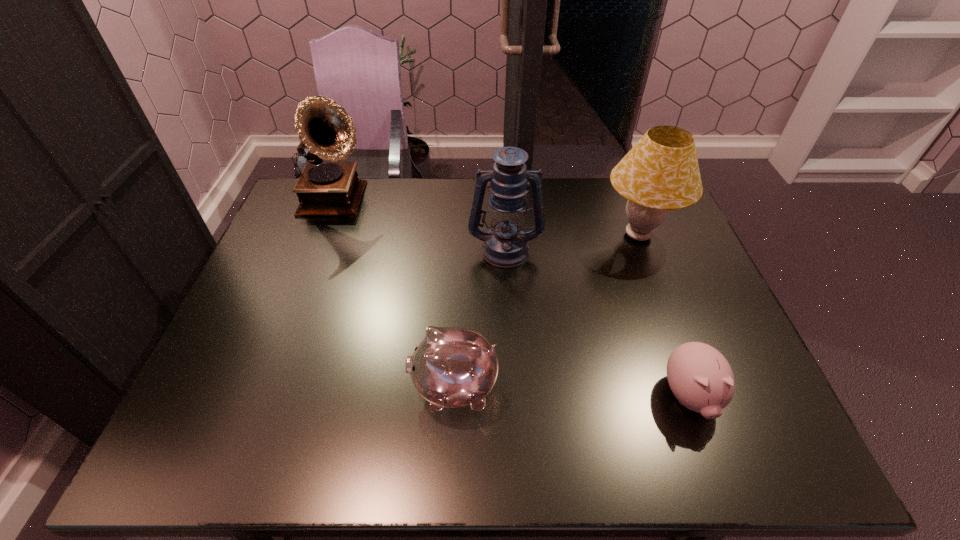
Identify the location of free space located 0.220m on the front facing side of the taller piggy bank. (314, 387).

Identify the location of free space located 0.330m on the front facing side of the taller piggy bank. The height and width of the screenshot is (540, 960). (266, 387).

Identify the location of free region located on the front facing side of the taller piggy bank. Image resolution: width=960 pixels, height=540 pixels. (293, 387).

The width and height of the screenshot is (960, 540). I want to click on record player located at the far edge, so click(325, 188).

Identify the location of lampshade that is at the far edge. This screenshot has height=540, width=960. (660, 173).

This screenshot has width=960, height=540. Find the location of `object located in the near edge section of the desktop`. object located in the near edge section of the desktop is located at coordinates (700, 377).

Identify the location of object that is at the left edge. (325, 188).

Image resolution: width=960 pixels, height=540 pixels. In order to click on lampshade at the right edge in this screenshot , I will do `click(660, 173)`.

Locate an element on the screen. The width and height of the screenshot is (960, 540). piggy bank that is at the right edge is located at coordinates (700, 377).

Where is `object that is at the far left corner`? object that is at the far left corner is located at coordinates (325, 188).